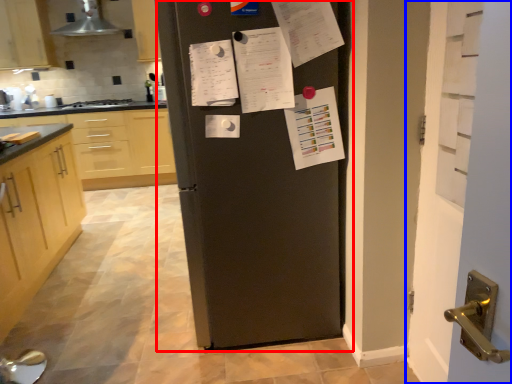
Question: Which object is closer to the camera taking this photo, refrigerator (highlighted by a red box) or door (highlighted by a blue box)?

Choices:
 (A) refrigerator
 (B) door

Answer: (B)